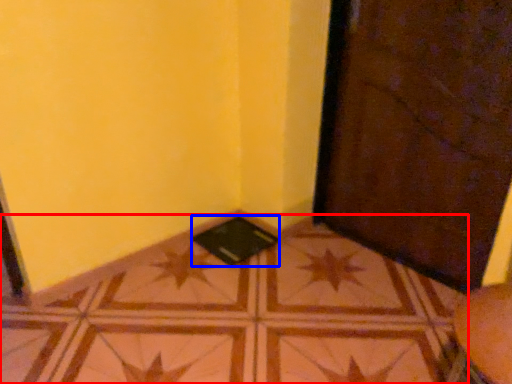
Question: Which of the following is the farthest to the observer, tile (highlighted by a red box) or pad (highlighted by a blue box)?

Choices:
 (A) tile
 (B) pad

Answer: (B)